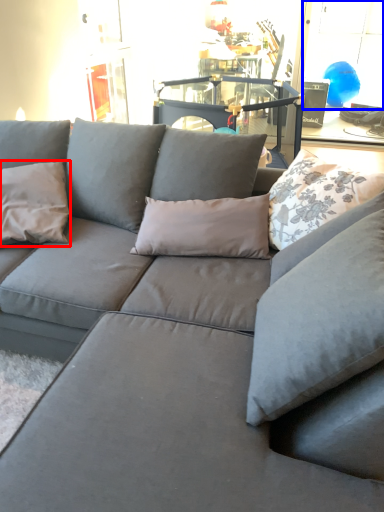
Question: Which of the following is the closest to the observer, pillow (highlighted by a red box) or window (highlighted by a blue box)?

Choices:
 (A) pillow
 (B) window

Answer: (A)